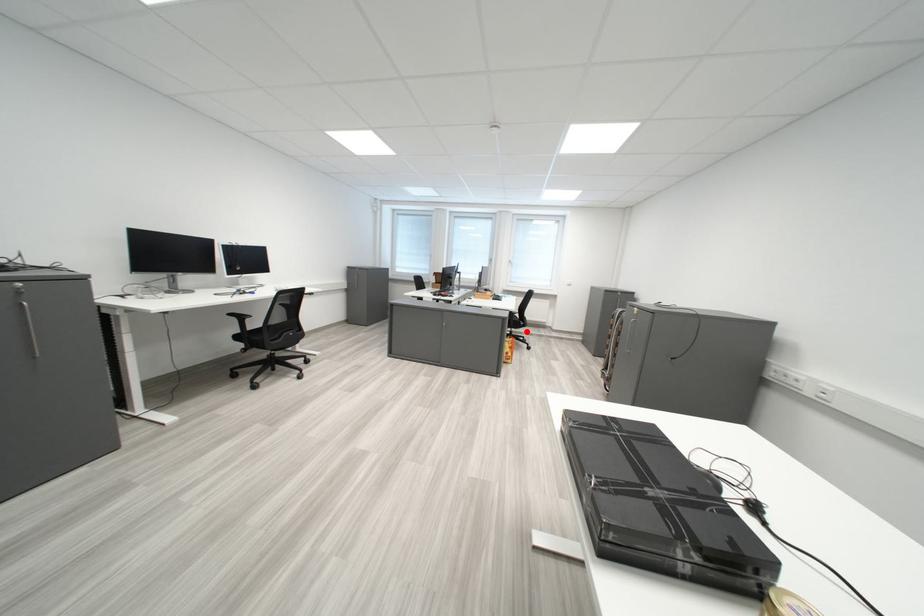
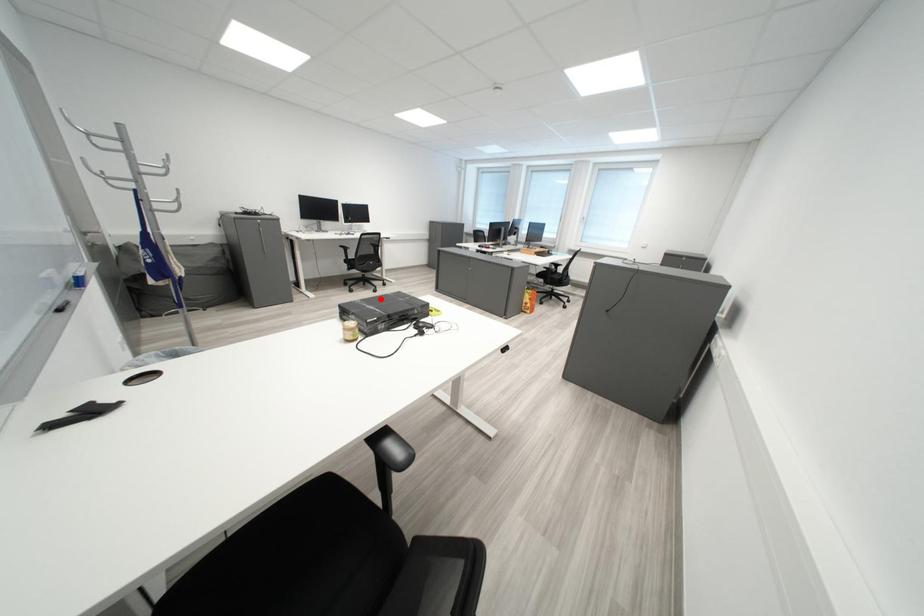
I am providing you with two images of the same scene from different viewpoints. A red point is marked on the first image and another point is marked on the second image. Are the points marked in image1 and image2 representing the same 3D position?

No